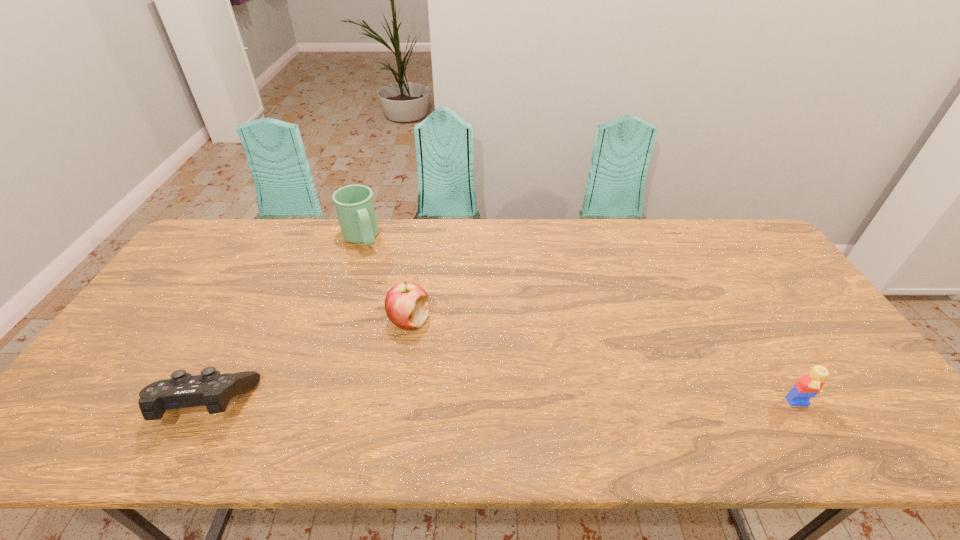
The image size is (960, 540). I want to click on free space on the desktop that is between the shortest object and the Lego and is positioned on the bitten side of the third object from left to right, so click(x=431, y=404).

I want to click on vacant space on the desktop that is between the shortest object and the Lego and is positioned on the side of the farthest object with the handle, so click(461, 405).